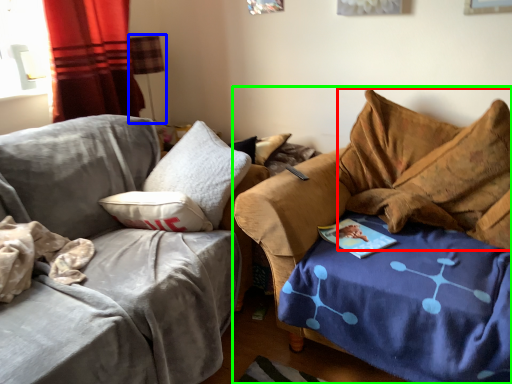
Question: Which object is positioned farthest from bean bag chair (highlighted by a red box)? Select from lamp (highlighted by a blue box) and studio couch (highlighted by a green box).

Choices:
 (A) lamp
 (B) studio couch

Answer: (A)